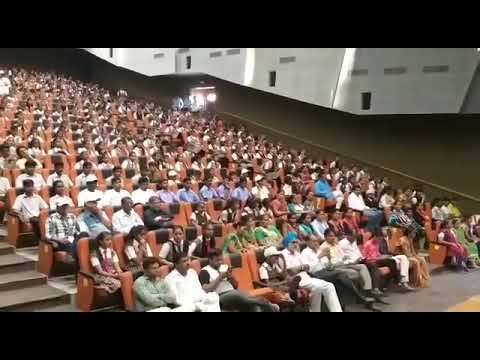
At what (x,y) coordinates should I click in order to perform the action: click on black spaces in whwite wall. Please return your answer as a coordinate pair (x, y). This screenshot has height=360, width=480. Looking at the image, I should click on (367, 101), (274, 77), (187, 64), (112, 54).